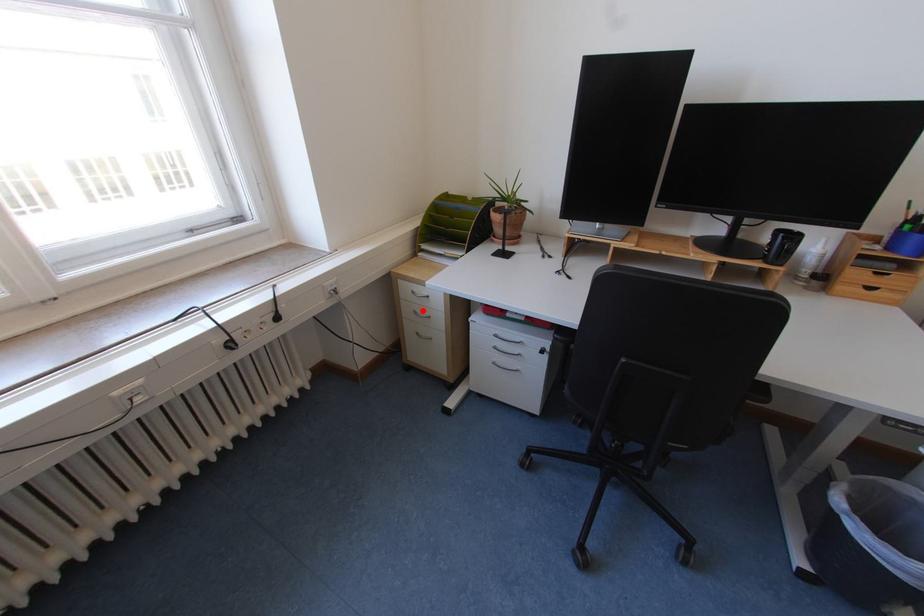
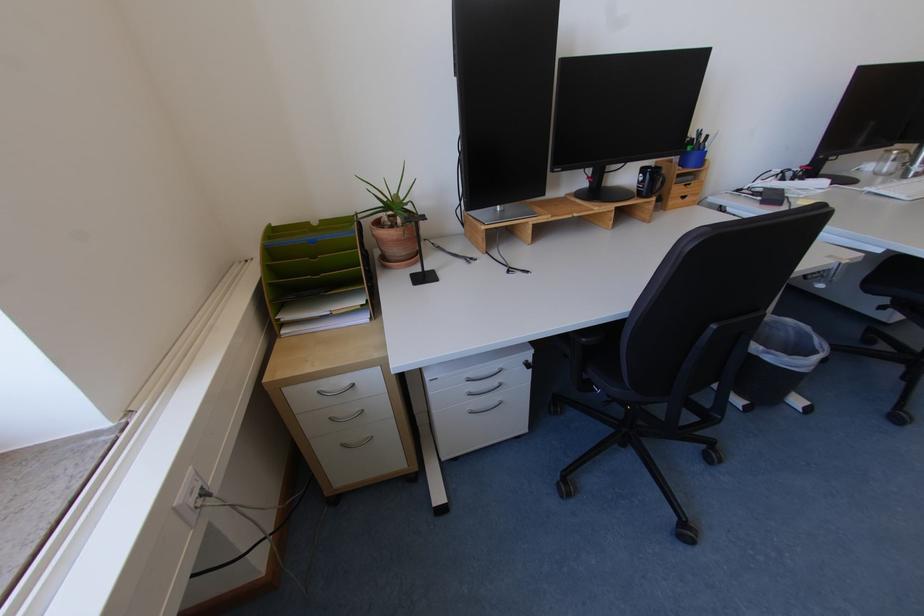
In the second image, find the point that corresponds to the highlighted location in the first image.

(337, 416)